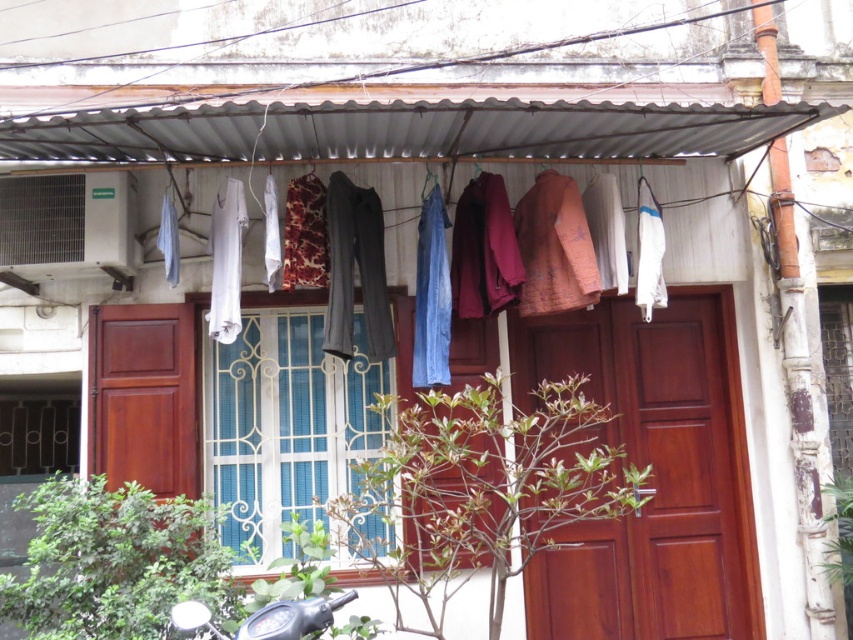
Is blue fabric pants at upper center smaller than metallic silver motorcycle at lower left?

No.

Which is above, blue fabric pants at upper center or metallic silver motorcycle at lower left?

blue fabric pants at upper center is above.

Between point (381, 164) and point (312, 627), which one is positioned in front?

Point (312, 627)

The height and width of the screenshot is (640, 853). What are the coordinates of `blue fabric pants at upper center` in the screenshot? It's located at (395, 212).